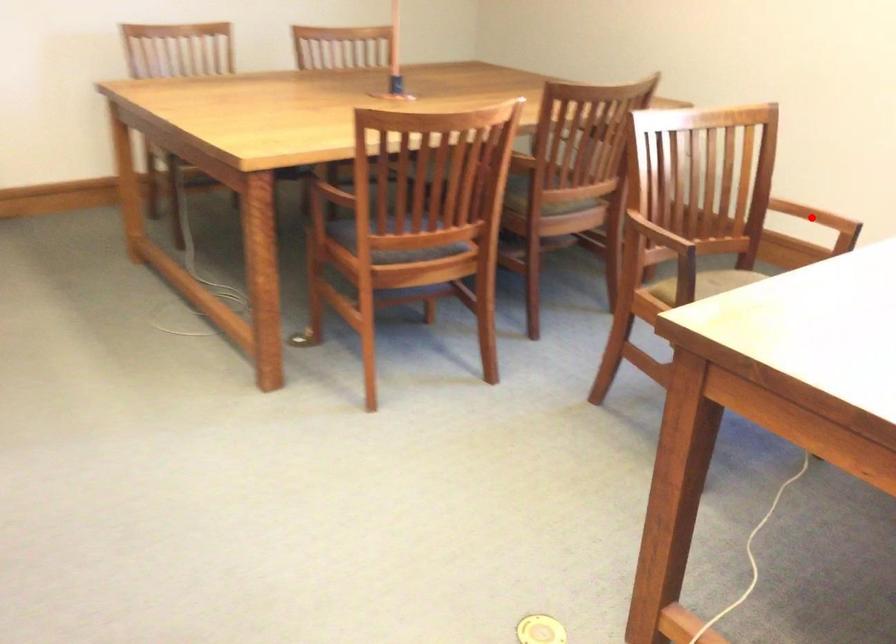
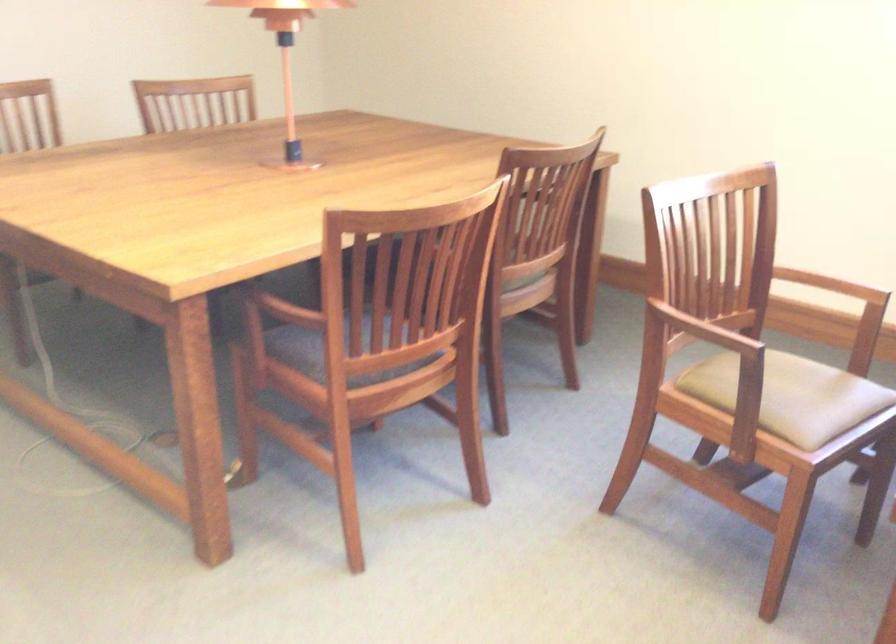
Find the pixel in the second image that matches the highlighted location in the first image.

(832, 285)